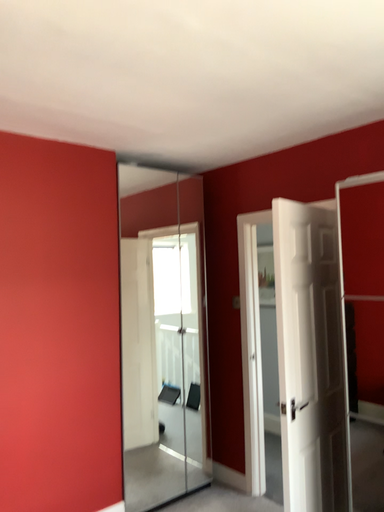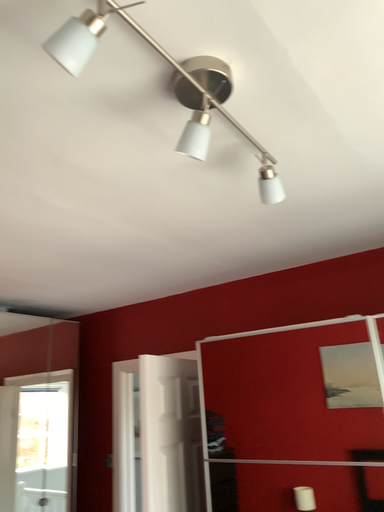
Question: How did the camera likely rotate when shooting the video?

Choices:
 (A) rotated right
 (B) rotated left

Answer: (A)